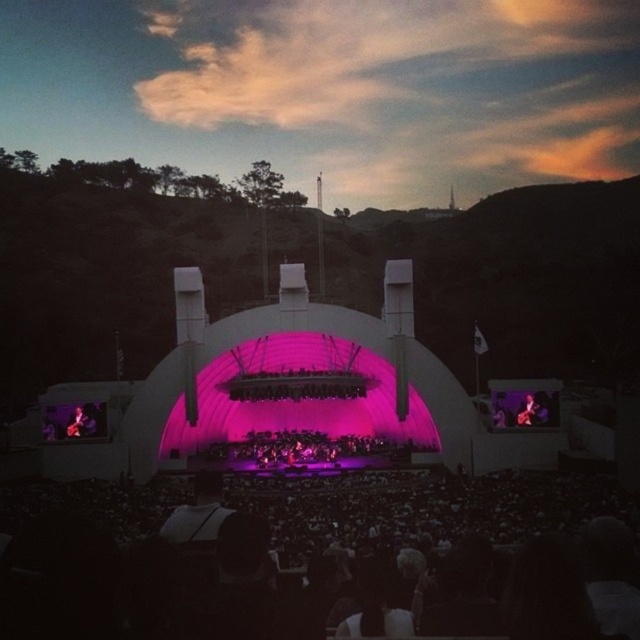
Question: Which is nearer to the shiny purple dress at center?

Choices:
 (A) metallic guitar at center
 (B) black fabric crowd at lower center
 (C) matte black guitar at center

Answer: (B)

Question: Among these points, which one is nearest to the camera?

Choices:
 (A) pos(451,502)
 (B) pos(337,461)

Answer: (A)

Question: Does black fabric crowd at lower center appear on the right side of shiny purple dress at center?

Choices:
 (A) no
 (B) yes

Answer: (A)

Question: Which object appears farthest from the camera in this image?

Choices:
 (A) shiny purple dress at center
 (B) metallic guitar at center
 (C) black fabric crowd at lower center
 (D) matte black guitar at center

Answer: (A)

Question: Is black fabric crowd at lower center positioned before metallic guitar at center?

Choices:
 (A) yes
 (B) no

Answer: (A)

Question: Does shiny purple dress at center appear on the left side of metallic guitar at center?

Choices:
 (A) no
 (B) yes

Answer: (A)